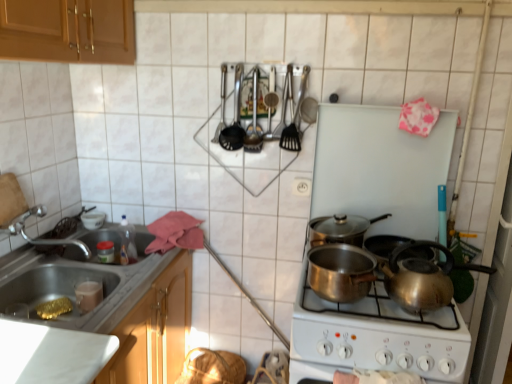
Question: In the image, is polished copper pot at center, the first kitchen appliance ordered from the bottom, positioned in front of or behind shiny silver pot at center, which is the 1th kitchen appliance in top-to-bottom order?

Choices:
 (A) front
 (B) behind

Answer: (A)

Question: Considering the positions of point (367, 258) and point (356, 236), is point (367, 258) closer or farther from the camera than point (356, 236)?

Choices:
 (A) farther
 (B) closer

Answer: (B)

Question: Based on their relative distances, which object is farther from the polished copper pot at center, which ranks as the 2th kitchen appliance in top-to-bottom order?

Choices:
 (A) polished stainless steel utensils at upper center
 (B) metallic cooking utensils at upper center
 (C) satin silver kettle at lower right
 (D) gold foil at lower left
 (E) metallic sink at lower left

Answer: (D)

Question: Based on their relative distances, which object is nearer to the white plastic socket at center?

Choices:
 (A) satin silver kettle at lower right
 (B) metallic sink at lower left
 (C) metallic cooking utensils at upper center
 (D) polished copper pot at center, which ranks as the 2th kitchen appliance in top-to-bottom order
 (E) shiny silver pot at center, which is the second kitchen appliance in bottom-to-top order

Answer: (E)